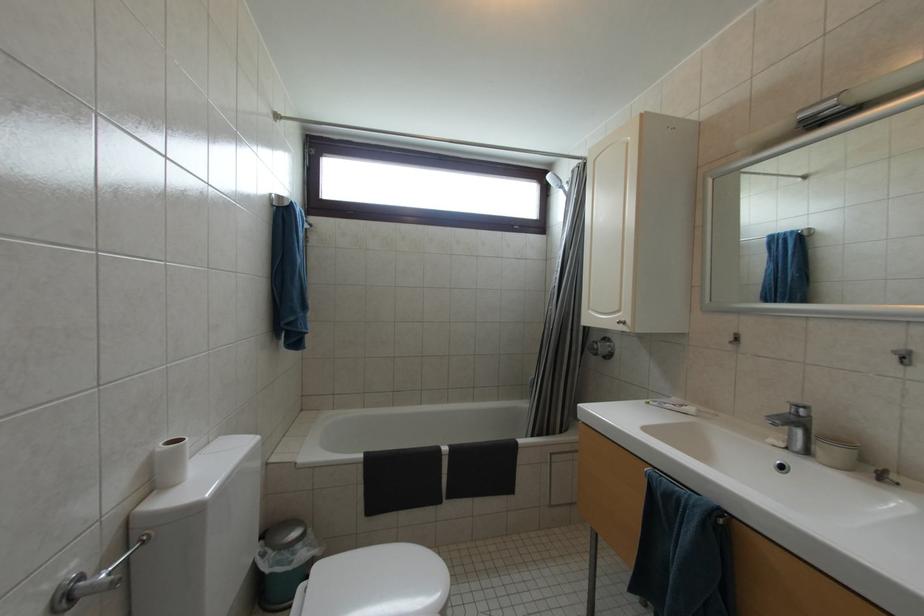
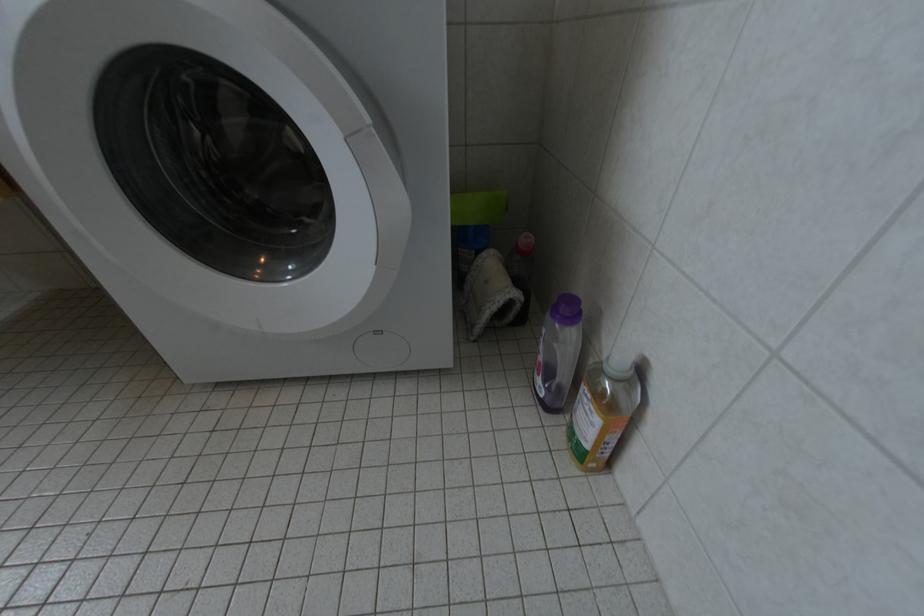
Based on the continuous images, in which direction is the camera rotating?

The rotation direction of the camera is right-down.